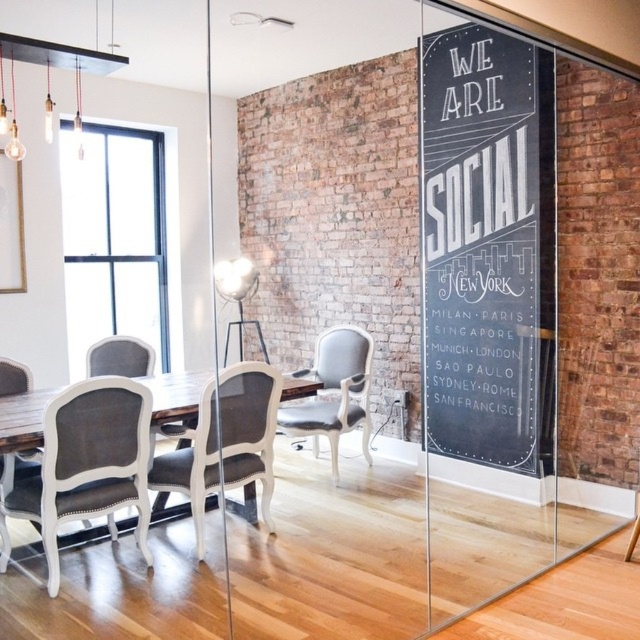
Which of these two, white upholstered chair at center or gray fabric chair at lower left, stands taller?

white upholstered chair at center is taller.

Does point (209, 456) come in front of point (122, 346)?

Yes.

Where is `white upholstered chair at center`? Image resolution: width=640 pixels, height=640 pixels. white upholstered chair at center is located at coordinates (225, 442).

Between white upholstered chair at center and light gray fabric chair at center, which one has more height?

light gray fabric chair at center

Does point (218, 445) come farther from viewer compared to point (282, 426)?

No.

Does point (204, 483) come farther from viewer compared to point (298, 376)?

No, (204, 483) is in front of (298, 376).

In order to click on white upholstered chair at center in this screenshot , I will do `click(225, 442)`.

Which is below, chalkboard sign at upper right or light gray fabric chair at center?

light gray fabric chair at center is lower down.

Does chalkboard sign at upper right appear on the right side of light gray fabric chair at center?

Yes, chalkboard sign at upper right is to the right of light gray fabric chair at center.

Is point (442, 314) closer to camera compared to point (368, 442)?

Yes.

Image resolution: width=640 pixels, height=640 pixels. In order to click on chalkboard sign at upper right in this screenshot , I will do `click(488, 248)`.